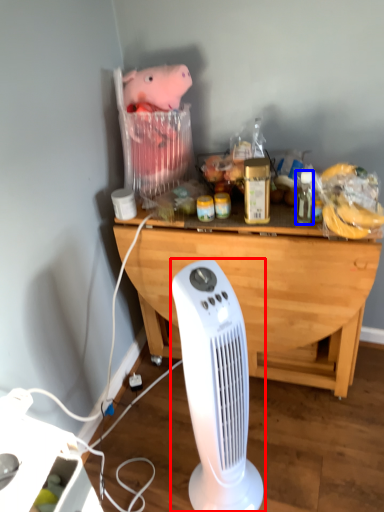
Question: Which point is further to the camera, home appliance (highlighted by a red box) or bottle (highlighted by a blue box)?

Choices:
 (A) home appliance
 (B) bottle

Answer: (B)